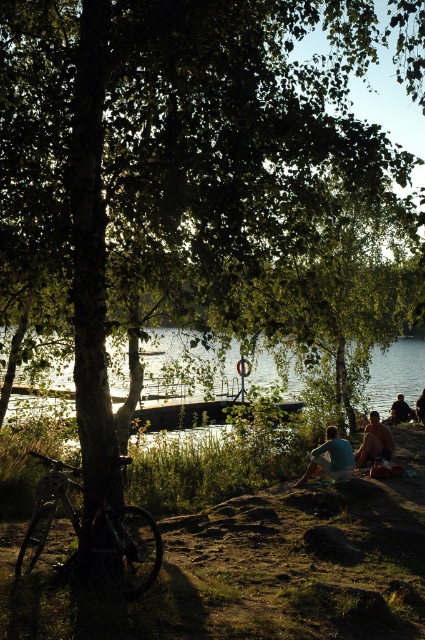
Question: Is shiny metallic bicycle at lower left bigger than tan skin person at lower right?

Choices:
 (A) no
 (B) yes

Answer: (B)

Question: Which point is farther to the camera?

Choices:
 (A) (382, 436)
 (B) (407, 419)
 (C) (418, 362)
 (D) (416, 404)

Answer: (C)

Question: Which object appears closest to the camera in this image?

Choices:
 (A) clear water at center
 (B) dark blue jeans at lower right
 (C) blue cotton shirt at center
 (D) shiny metallic bicycle at lower left

Answer: (D)

Question: Is blue cotton shirt at center to the left of dark blue jeans at lower right from the viewer's perspective?

Choices:
 (A) yes
 (B) no

Answer: (A)

Question: Is shiny metallic bicycle at lower left below tan skin person at lower right?

Choices:
 (A) yes
 (B) no

Answer: (A)

Question: Which object is farther from the camera taking this photo?

Choices:
 (A) clear water at center
 (B) dark blue jeans at lower right
 (C) smooth dirt shore at lower center
 (D) blue cotton shirt at center

Answer: (B)